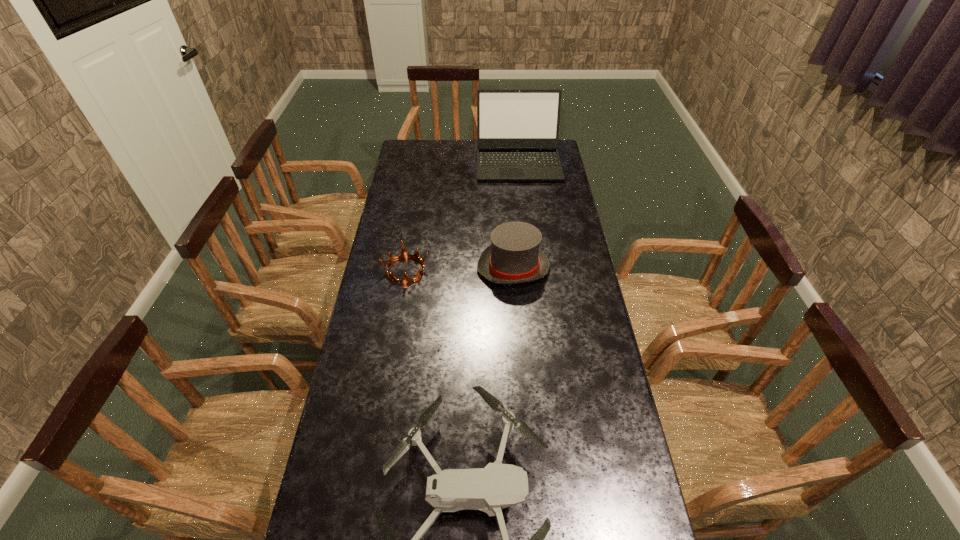
The width and height of the screenshot is (960, 540). I want to click on free point between the shortest object and the farthest object, so click(462, 215).

Find the location of a particular element. The height and width of the screenshot is (540, 960). object that is the second closest to the crown is located at coordinates tap(497, 486).

Select which object appears as the second closest to the dress hat. Please provide its 2D coordinates. Your answer should be formatted as a tuple, i.e. [(x, y)], where the tuple contains the x and y coordinates of a point satisfying the conditions above.

[(517, 130)]